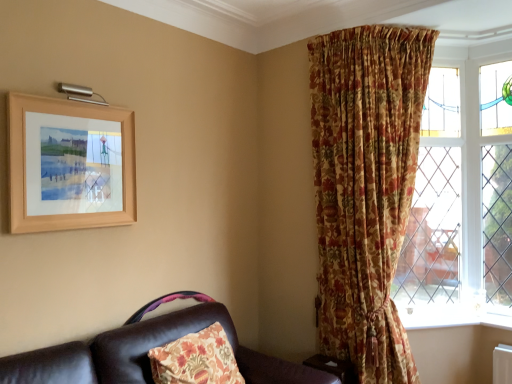
The height and width of the screenshot is (384, 512). Describe the element at coordinates (365, 187) in the screenshot. I see `floral fabric curtain at upper right` at that location.

You are a GUI agent. You are given a task and a screenshot of the screen. Output one action in this format:
    pyautogui.click(x=<x>, y=<y>)
    Task: Click on the leather couch at lower left
    
    Given the screenshot: What is the action you would take?
    pyautogui.click(x=147, y=354)

You are a GUI agent. You are given a task and a screenshot of the screen. Output one action in this format:
    pyautogui.click(x=<x>, y=<y>)
    Task: Click on the wooden frame at upper left
    
    Given the screenshot: What is the action you would take?
    pyautogui.click(x=69, y=164)

Is leather couch at lower left in front of floral fabric curtain at upper right?

Yes.

From the picture: Which point is more forward, (118,379) or (318,58)?

The point (118,379) is closer to the camera.

Is leather couch at lower left touching floral fabric curtain at upper right?

There is a gap between leather couch at lower left and floral fabric curtain at upper right.

From the image's perspective, is floral fabric curtain at upper right located beneath wooden frame at upper left?

Yes.

Is floral fabric curtain at upper right surrounding wooden frame at upper left?

No, wooden frame at upper left is not a part of floral fabric curtain at upper right.

From the picture: Is white painted wood at lower right positioned with its back to floral fabric curtain at upper right?

white painted wood at lower right is not turned away from floral fabric curtain at upper right.

Is white painted wood at lower right not within floral fabric curtain at upper right?

white painted wood at lower right lies outside floral fabric curtain at upper right's area.

In the image, is white painted wood at lower right on the left side or the right side of floral fabric curtain at upper right?

From the image, it's evident that white painted wood at lower right is to the right of floral fabric curtain at upper right.

Does white painted wood at lower right touch floral fabric curtain at upper right?

They are not placed beside each other.

Which is less distant, (377, 208) or (237, 339)?

Clearly, point (377, 208) is closer to the camera than point (237, 339).

Is leather couch at lower left at the back of floral fabric curtain at upper right?

That's not correct — floral fabric curtain at upper right is not looking away from leather couch at lower left.

From the image's perspective, which one is positioned higher, floral fabric curtain at upper right or leather couch at lower left?

floral fabric curtain at upper right, from the image's perspective.

Considering the sizes of objects floral fabric curtain at upper right and leather couch at lower left in the image provided, who is shorter, floral fabric curtain at upper right or leather couch at lower left?

With less height is leather couch at lower left.

Which of these two, wooden frame at upper left or floral fabric curtain at upper right, stands taller?

floral fabric curtain at upper right is taller.

Considering the positions of point (66, 163) and point (389, 129), is point (66, 163) closer or farther from the camera than point (389, 129)?

Clearly, point (66, 163) is closer to the camera than point (389, 129).

Considering the relative sizes of wooden frame at upper left and floral fabric curtain at upper right in the image provided, is wooden frame at upper left thinner than floral fabric curtain at upper right?

Yes.

From a real-world perspective, which object rests below the other?

From a 3D spatial view, floral fabric curtain at upper right is below.

Can you confirm if white painted wood at lower right is smaller than wooden frame at upper left?

Correct, white painted wood at lower right occupies less space than wooden frame at upper left.

In the scene shown: How far apart are white painted wood at lower right and wooden frame at upper left?

6.78 feet.

Is point (489, 322) closer or farther from the camera than point (42, 161)?

Point (489, 322).

Is white painted wood at lower right not close to wooden frame at upper left?

white painted wood at lower right is far away from wooden frame at upper left.

In the image, is wooden frame at upper left on the left side or the right side of leather couch at lower left?

From the image, it's evident that wooden frame at upper left is to the left of leather couch at lower left.

Is leather couch at lower left completely or partially inside wooden frame at upper left?

No.

Is wooden frame at upper left far away from leather couch at lower left?

No.

Between point (13, 213) and point (290, 364), which one is positioned in front?

Point (13, 213)

Where is `curtain that appears behind the leather couch at lower left`? This screenshot has width=512, height=384. curtain that appears behind the leather couch at lower left is located at coordinates (365, 187).

The image size is (512, 384). There is a floral fabric curtain at upper right. Find the location of `picture frame above it (from a real-world perspective)`. picture frame above it (from a real-world perspective) is located at coordinates (69, 164).

In the scene shown: Estimate the real-world distances between objects in this image. Which object is closer to wooden frame at upper left, white painted wood at lower right or floral fabric curtain at upper right?

Based on the image, floral fabric curtain at upper right appears to be nearer to wooden frame at upper left.

Which object lies nearer to the anchor point white painted wood at lower right, leather couch at lower left or floral fabric curtain at upper right?

→ floral fabric curtain at upper right lies closer to white painted wood at lower right than the other object.

Estimate the real-world distances between objects in this image. Which object is closer to leather couch at lower left, floral fabric curtain at upper right or wooden frame at upper left?

wooden frame at upper left is closer to leather couch at lower left.

Looking at the image, which one is located further to leather couch at lower left, white painted wood at lower right or wooden frame at upper left?

white painted wood at lower right lies further to leather couch at lower left than the other object.

Considering their positions, is leather couch at lower left positioned further to floral fabric curtain at upper right than wooden frame at upper left?

wooden frame at upper left lies further to floral fabric curtain at upper right than the other object.

From the image, which object appears to be farther from floral fabric curtain at upper right, leather couch at lower left or white painted wood at lower right?

leather couch at lower left.

Based on their spatial positions, is wooden frame at upper left or leather couch at lower left further from floral fabric curtain at upper right?

wooden frame at upper left is positioned further to the anchor floral fabric curtain at upper right.

Which object lies further to the anchor point leather couch at lower left, wooden frame at upper left or floral fabric curtain at upper right?

floral fabric curtain at upper right is further to leather couch at lower left.

This screenshot has width=512, height=384. What are the coordinates of `curtain positioned between leather couch at lower left and white painted wood at lower right from near to far` in the screenshot? It's located at (365, 187).

Locate an element on the screen. Image resolution: width=512 pixels, height=384 pixels. curtain located between wooden frame at upper left and white painted wood at lower right in the left-right direction is located at coordinates (365, 187).

I want to click on studio couch between wooden frame at upper left and floral fabric curtain at upper right in the horizontal direction, so click(147, 354).

You are a GUI agent. You are given a task and a screenshot of the screen. Output one action in this format:
    pyautogui.click(x=<x>, y=<y>)
    Task: Click on the studio couch located between wooden frame at upper left and white painted wood at lower right in the left-right direction
    The width and height of the screenshot is (512, 384).
    Given the screenshot: What is the action you would take?
    pyautogui.click(x=147, y=354)